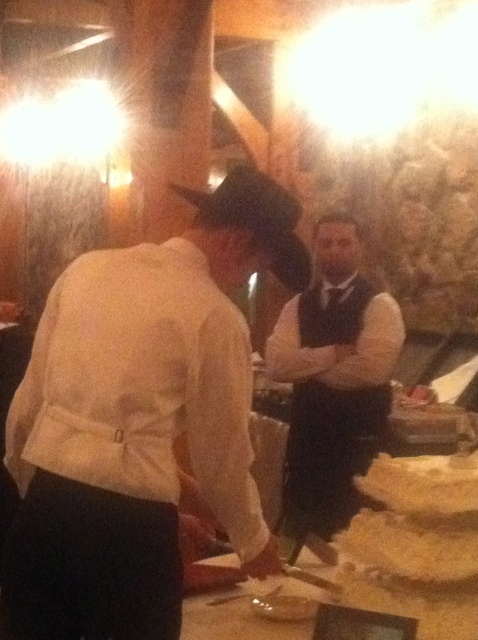
You are at a wedding reception and see two golden items on a dessert table. One is a golden crumbly pastry at lower right and the other is a golden crispy bread at lower right. Which one is positioned more to the left?

The golden crumbly pastry at lower right is positioned more to the left compared to the golden crispy bread at lower right.

You are a guest at this event and want to grab both the golden crumbly pastry at lower center and the golden crispy bread at lower right. Can you reach both items without moving your position?

The distance between the golden crumbly pastry at lower center and the golden crispy bread at lower right is 3.16 inches, so yes, you can reach both items without moving your position as they are close enough.

You are a photographer at this event and need to capture a photo that includes both the white matte hat at upper left and the golden crispy bread at lower right. What is the minimum distance you need to move your camera to ensure both objects are in frame?

The minimum distance to move the camera would depend on the camera lens and sensor size, but the objects are 17.88 inches apart. Ensure the camera frame can encompass this distance between them.